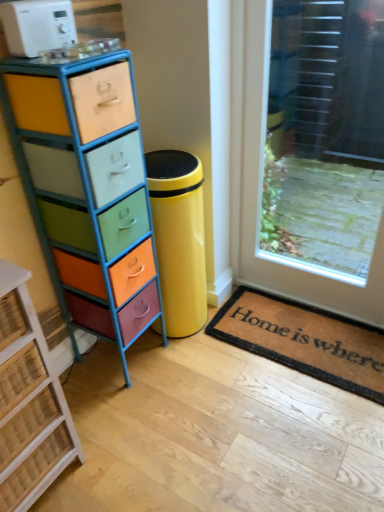
This screenshot has height=512, width=384. I want to click on free spot below multicolored painted wood chest of drawers at left, which is the second chest of drawers in left-to-right order (from a real-world perspective), so click(x=127, y=359).